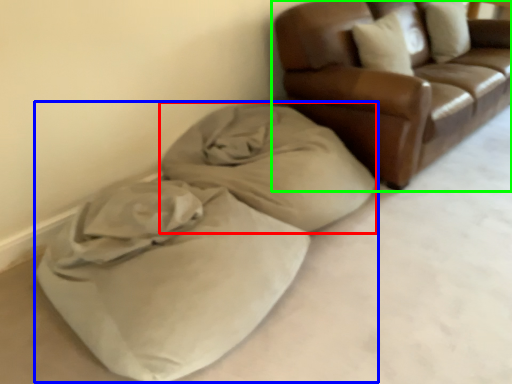
Question: Which object is positioned closest to blanket (highlighted by a red box)? Select from bean bag chair (highlighted by a blue box) and studio couch (highlighted by a green box).

Choices:
 (A) bean bag chair
 (B) studio couch

Answer: (A)